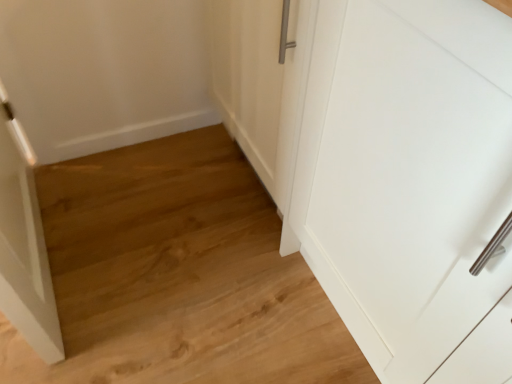
Where is `free space to the left of white matte cupboard at right`? The height and width of the screenshot is (384, 512). free space to the left of white matte cupboard at right is located at coordinates (216, 284).